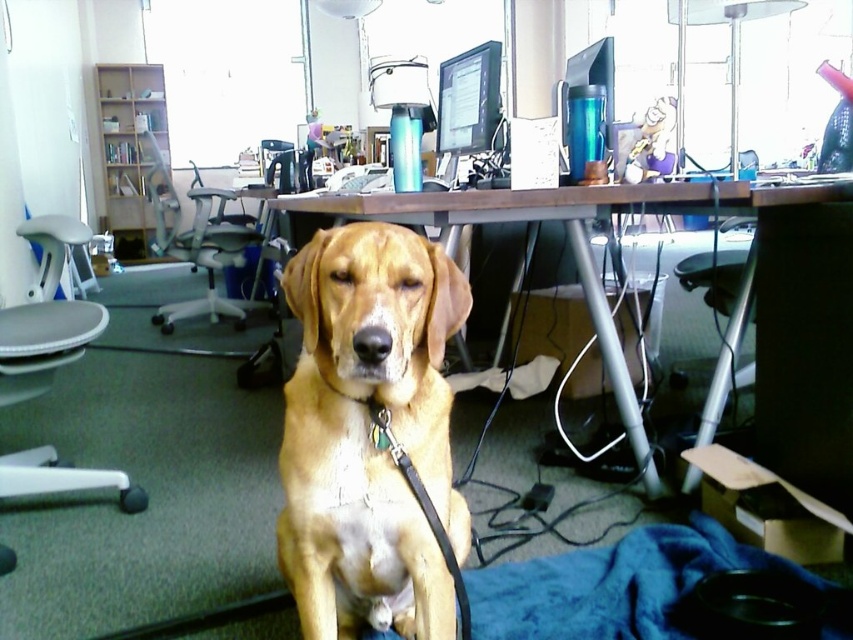
Is white plastic office chair at left wider than matte black monitor at upper center?

Yes.

Between white plastic office chair at left and matte black monitor at upper center, which one has more height?

With more height is white plastic office chair at left.

Is point (148, 172) positioned behind point (463, 52)?

Yes, point (148, 172) is behind point (463, 52).

Where is `white plastic office chair at left`? Image resolution: width=853 pixels, height=640 pixels. white plastic office chair at left is located at coordinates (196, 243).

Is golden fur dog at center wider than white plastic office chair at left?

No.

Does point (337, 400) come closer to viewer compared to point (206, 298)?

That is True.

Locate an element on the screen. This screenshot has height=640, width=853. golden fur dog at center is located at coordinates (370, 435).

Is golden fur dog at center closer to the viewer compared to brown wooden desk at center?

That is True.

Locate an element on the screen. This screenshot has height=640, width=853. golden fur dog at center is located at coordinates (370, 435).